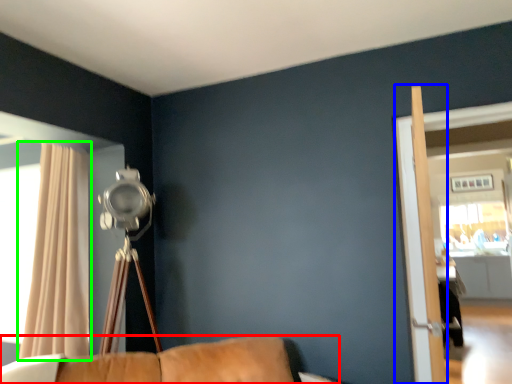
Question: Based on their relative distances, which object is nearer to furniture (highlighted by a red box)? Choose from screen door (highlighted by a blue box) and curtain (highlighted by a green box).

Choices:
 (A) screen door
 (B) curtain

Answer: (B)